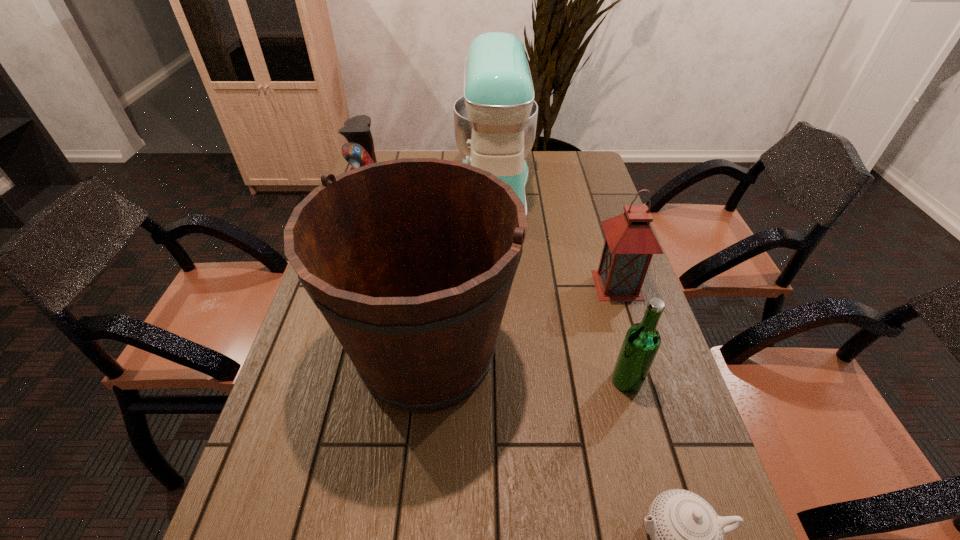
The image size is (960, 540). I want to click on free space located 0.210m at the face of the parrot, so click(x=445, y=206).

You are a GUI agent. You are given a task and a screenshot of the screen. Output one action in this format:
    pyautogui.click(x=<x>, y=<y>)
    Task: Click on the vacant point located on the left of the beer bottle
    
    Given the screenshot: What is the action you would take?
    pyautogui.click(x=442, y=381)

The image size is (960, 540). Identify the location of object that is positioned at the far edge. (495, 120).

Image resolution: width=960 pixels, height=540 pixels. In order to click on bucket that is at the left edge in this screenshot , I will do `click(411, 261)`.

Where is `parrot that is at the left edge`? This screenshot has width=960, height=540. parrot that is at the left edge is located at coordinates (359, 152).

Identify the location of lantern that is at the right edge. (630, 243).

Where is `beer bottle present at the right edge`? This screenshot has height=540, width=960. beer bottle present at the right edge is located at coordinates (642, 341).

The height and width of the screenshot is (540, 960). In order to click on blank area at the far edge in this screenshot , I will do `click(541, 164)`.

Where is `vacant space at the left edge of the desktop`? This screenshot has height=540, width=960. vacant space at the left edge of the desktop is located at coordinates (342, 399).

Where is `free space at the right edge of the desktop`? This screenshot has height=540, width=960. free space at the right edge of the desktop is located at coordinates (676, 386).